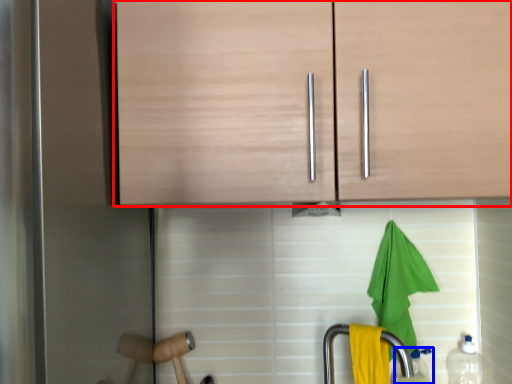
Question: Which of the following is the closest to the observer, cabinetry (highlighted by a red box) or bottle (highlighted by a blue box)?

Choices:
 (A) cabinetry
 (B) bottle

Answer: (A)